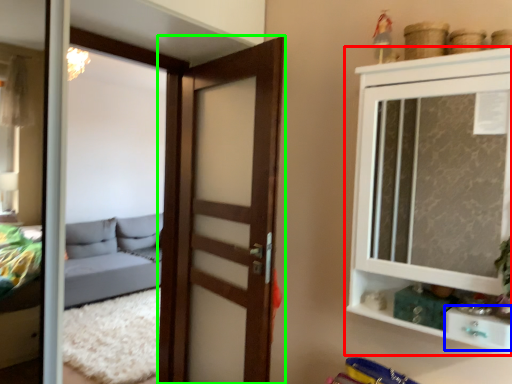
Question: Based on their relative distances, which object is nearer to cupboard (highlighted by a red box)? Choose from drawer (highlighted by a blue box) and door (highlighted by a green box).

Choices:
 (A) drawer
 (B) door

Answer: (A)